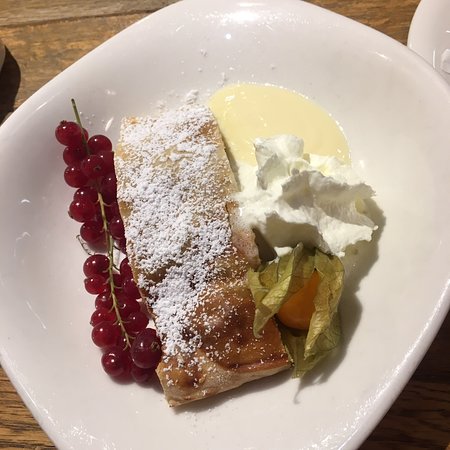
Identify the location of plate rim. The image size is (450, 450). (433, 322).